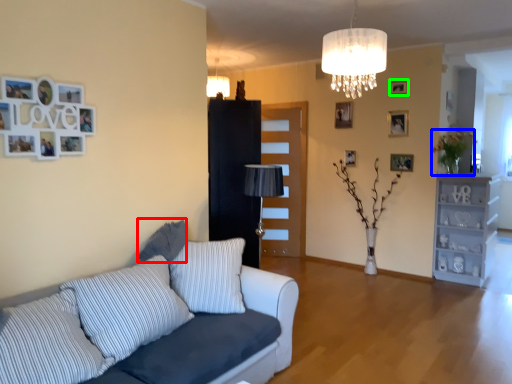
Question: Which is farther away from pillow (highlighted by a red box)? plant (highlighted by a blue box) or picture frame (highlighted by a green box)?

Choices:
 (A) plant
 (B) picture frame

Answer: (A)